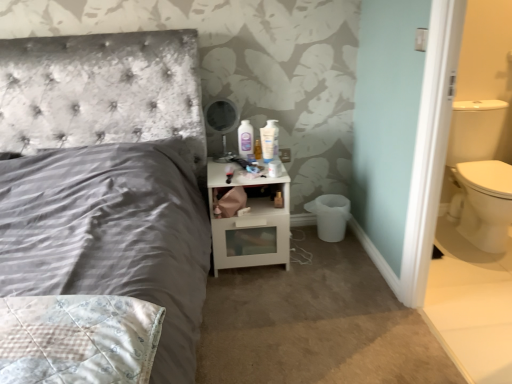
The image size is (512, 384). Describe the element at coordinates (250, 224) in the screenshot. I see `white glossy nightstand at center` at that location.

The image size is (512, 384). I want to click on white matte toilet paper at lower right, so click(243, 211).

What is the approximate height of white matte toilet paper at lower right?

The height of white matte toilet paper at lower right is 1.81 inches.

Image resolution: width=512 pixels, height=384 pixels. What are the coordinates of `white glossy nightstand at center` in the screenshot? It's located at (250, 224).

From the image's perspective, which one is positioned lower, white glossy mouthwash at upper center or white matte toilet paper at lower right?

From the image's view, white matte toilet paper at lower right is below.

Based on their sizes in the image, would you say white glossy mouthwash at upper center is bigger or smaller than white matte toilet paper at lower right?

Considering their sizes, white glossy mouthwash at upper center takes up more space than white matte toilet paper at lower right.

Would you consider white glossy mouthwash at upper center to be distant from white matte toilet paper at lower right?

No, white glossy mouthwash at upper center is not far away from white matte toilet paper at lower right.

Consider the image. From the image's perspective, which one is positioned higher, white glossy mouthwash at upper center or white glossy nightstand at center?

white glossy mouthwash at upper center appears higher in the image.

Is white glossy mouthwash at upper center positioned before white glossy nightstand at center?

No.

Can you confirm if white glossy mouthwash at upper center is bigger than white glossy nightstand at center?

Actually, white glossy mouthwash at upper center might be smaller than white glossy nightstand at center.

Is white glossy mouthwash at upper center not close to white glossy nightstand at center?

A: No.

How distant is white glossy nightstand at center from white matte toilet paper at lower right?

white glossy nightstand at center and white matte toilet paper at lower right are 6.75 inches apart.

Does white glossy nightstand at center appear on the right side of white matte toilet paper at lower right?

Indeed, white glossy nightstand at center is positioned on the right side of white matte toilet paper at lower right.

Is white glossy nightstand at center positioned with its back to white matte toilet paper at lower right?

No, white glossy nightstand at center is not facing the opposite direction of white matte toilet paper at lower right.

From the image's perspective, is white glossy nightstand at center on white matte toilet paper at lower right?

No, from the image's perspective, white glossy nightstand at center is not on top of white matte toilet paper at lower right.

Considering the points (246, 208) and (249, 204), which point is in front, point (246, 208) or point (249, 204)?

Point (246, 208)

Measure the distance from white matte toilet paper at lower right to white glossy nightstand at center.

white matte toilet paper at lower right is 17.14 centimeters from white glossy nightstand at center.

Considering the positions of objects white matte toilet paper at lower right and white glossy nightstand at center in the image provided, who is more to the right, white matte toilet paper at lower right or white glossy nightstand at center?

white glossy nightstand at center.

Is white matte toilet paper at lower right turned away from white glossy nightstand at center?

Yes, white matte toilet paper at lower right's orientation is away from white glossy nightstand at center.

Does white glossy nightstand at center turn towards white glossy mouthwash at upper center?

Answer: No.

Is white glossy nightstand at center inside or outside of white glossy mouthwash at upper center?

white glossy nightstand at center exists outside the volume of white glossy mouthwash at upper center.

From a real-world perspective, is white glossy nightstand at center below white glossy mouthwash at upper center?

Yes, from a real-world perspective, white glossy nightstand at center is beneath white glossy mouthwash at upper center.

How many degrees apart are the facing directions of white glossy nightstand at center and white glossy mouthwash at upper center?

The facing directions of white glossy nightstand at center and white glossy mouthwash at upper center are 10.6 degrees apart.

Considering the relative sizes of white matte toilet paper at lower right and white glossy mouthwash at upper center in the image provided, is white matte toilet paper at lower right wider than white glossy mouthwash at upper center?

In fact, white matte toilet paper at lower right might be narrower than white glossy mouthwash at upper center.

The height and width of the screenshot is (384, 512). I want to click on toilet paper below the white glossy mouthwash at upper center (from the image's perspective), so click(x=243, y=211).

Are white matte toilet paper at lower right and white glossy mouthwash at upper center far apart?

white matte toilet paper at lower right is near white glossy mouthwash at upper center, not far away.

Who is taller, white matte toilet paper at lower right or white glossy mouthwash at upper center?

With more height is white glossy mouthwash at upper center.

The image size is (512, 384). I want to click on mouthwash behind the white matte toilet paper at lower right, so click(x=269, y=141).

The width and height of the screenshot is (512, 384). I want to click on mouthwash that appears on the right of white glossy nightstand at center, so click(269, 141).

From the image, which object appears to be nearer to white glossy mouthwash at upper center, white matte toilet paper at lower right or white glossy nightstand at center?

white glossy nightstand at center.

Based on their spatial positions, is white glossy nightstand at center or white glossy mouthwash at upper center further from white matte toilet paper at lower right?

Among the two, white glossy mouthwash at upper center is located further to white matte toilet paper at lower right.

Which object lies further to the anchor point white glossy mouthwash at upper center, white glossy nightstand at center or white matte toilet paper at lower right?

white matte toilet paper at lower right is further to white glossy mouthwash at upper center.

Considering their positions, is white matte toilet paper at lower right positioned closer to white glossy nightstand at center than white glossy mouthwash at upper center?

Among the two, white matte toilet paper at lower right is located nearer to white glossy nightstand at center.

Estimate the real-world distances between objects in this image. Which object is closer to white matte toilet paper at lower right, white glossy mouthwash at upper center or white glossy nightstand at center?

Among the two, white glossy nightstand at center is located nearer to white matte toilet paper at lower right.

Looking at this image, from the image, which object appears to be farther from white glossy nightstand at center, white glossy mouthwash at upper center or white matte toilet paper at lower right?

Based on the image, white glossy mouthwash at upper center appears to be further to white glossy nightstand at center.

This screenshot has height=384, width=512. Find the location of `toilet paper between white glossy mouthwash at upper center and white glossy nightstand at center from top to bottom`. toilet paper between white glossy mouthwash at upper center and white glossy nightstand at center from top to bottom is located at coordinates (243, 211).